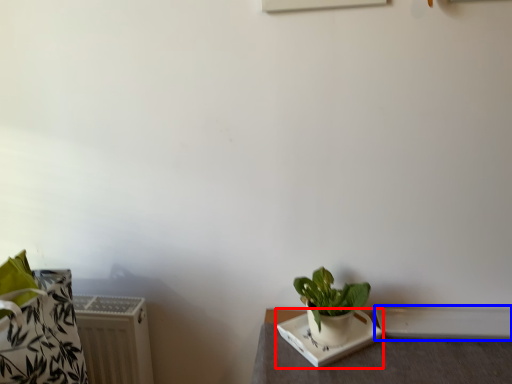
Question: Which of the following is the farthest to the observer, plate (highlighted by a red box) or window sill (highlighted by a blue box)?

Choices:
 (A) plate
 (B) window sill

Answer: (B)